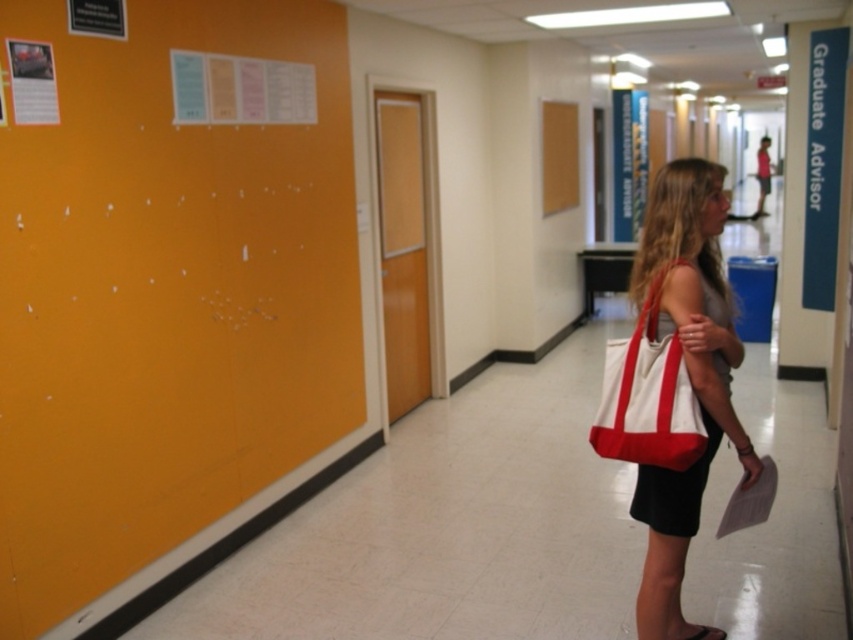
Question: Among these points, which one is farthest from the camera?

Choices:
 (A) (622, 392)
 (B) (668, 240)
 (C) (680, 628)

Answer: (C)

Question: Estimate the real-world distances between objects in this image. Which object is closer to the white canvas tote at right?

Choices:
 (A) white canvas tote bag at center-right
 (B) black leather sandal at lower right

Answer: (A)

Question: Is white canvas tote bag at center-right closer to camera compared to black leather sandal at lower right?

Choices:
 (A) no
 (B) yes

Answer: (B)

Question: Which object is farther from the camera taking this photo?

Choices:
 (A) white canvas tote at right
 (B) white canvas tote bag at center-right
 (C) black leather sandal at lower right

Answer: (C)

Question: Is white canvas tote at right wider than black leather sandal at lower right?

Choices:
 (A) no
 (B) yes

Answer: (B)

Question: Is white canvas tote at right wider than black leather sandal at lower right?

Choices:
 (A) no
 (B) yes

Answer: (B)